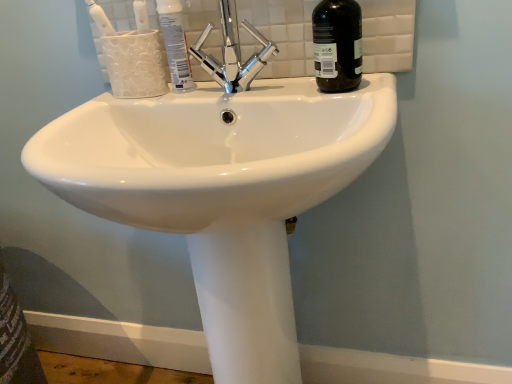
Question: Is white glossy toothpaste at upper center a part of white glossy toothbrush at upper left?

Choices:
 (A) yes
 (B) no

Answer: (B)

Question: Is white glossy toothbrush at upper left not within white glossy toothpaste at upper center?

Choices:
 (A) yes
 (B) no

Answer: (A)

Question: From a real-world perspective, is white glossy toothbrush at upper left positioned under white glossy toothpaste at upper center based on gravity?

Choices:
 (A) yes
 (B) no

Answer: (B)

Question: Is white glossy toothbrush at upper left facing towards white glossy toothpaste at upper center?

Choices:
 (A) yes
 (B) no

Answer: (B)

Question: From the image's perspective, is white glossy toothbrush at upper left below white glossy toothpaste at upper center?

Choices:
 (A) no
 (B) yes

Answer: (A)

Question: From the image's perspective, is polished chrome faucet at upper center above or below black glass bottle at upper right?

Choices:
 (A) above
 (B) below

Answer: (B)

Question: Is point (266, 46) closer or farther from the camera than point (318, 39)?

Choices:
 (A) farther
 (B) closer

Answer: (A)

Question: Choose the correct answer: Is polished chrome faucet at upper center inside black glass bottle at upper right or outside it?

Choices:
 (A) outside
 (B) inside

Answer: (A)

Question: Looking at the image, does polished chrome faucet at upper center seem bigger or smaller compared to black glass bottle at upper right?

Choices:
 (A) small
 (B) big

Answer: (B)

Question: From a real-world perspective, relative to white glossy toothbrush at upper left, is black glass bottle at upper right vertically above or below?

Choices:
 (A) below
 (B) above

Answer: (A)

Question: Visually, is black glass bottle at upper right positioned to the left or to the right of white glossy toothbrush at upper left?

Choices:
 (A) left
 (B) right

Answer: (B)

Question: Based on their sizes in the image, would you say black glass bottle at upper right is bigger or smaller than white glossy toothbrush at upper left?

Choices:
 (A) small
 (B) big

Answer: (B)

Question: Is black glass bottle at upper right spatially inside white glossy toothbrush at upper left, or outside of it?

Choices:
 (A) outside
 (B) inside

Answer: (A)

Question: Based on their sizes in the image, would you say white glossy sink at center is bigger or smaller than black glass bottle at upper right?

Choices:
 (A) big
 (B) small

Answer: (A)

Question: Is white glossy sink at center in front of or behind black glass bottle at upper right in the image?

Choices:
 (A) front
 (B) behind

Answer: (A)